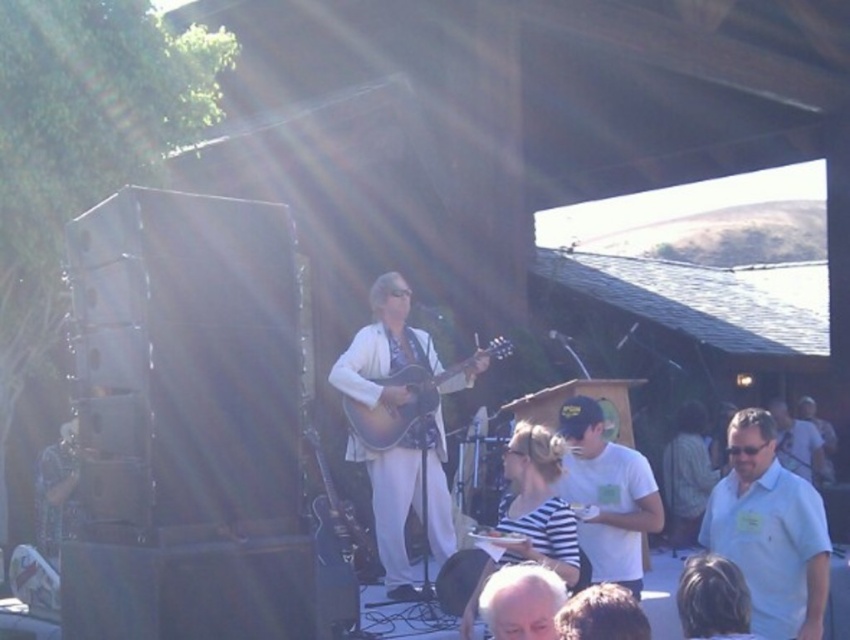
Question: Based on their relative distances, which object is nearer to the matte brown acoustic guitar at center?

Choices:
 (A) white matte hair at lower center
 (B) white shirt at center
 (C) white t-shirt at center

Answer: (C)

Question: Does white t-shirt at center have a larger size compared to glossy black guitar at center?

Choices:
 (A) yes
 (B) no

Answer: (B)

Question: Can you confirm if white shirt at lower right is thinner than matte brown guitar at center?

Choices:
 (A) yes
 (B) no

Answer: (A)

Question: In this image, where is matte brown acoustic guitar at center located relative to white shirt at center?

Choices:
 (A) right
 (B) left

Answer: (B)

Question: Based on their relative distances, which object is farther from the matte brown guitar at center?

Choices:
 (A) white shirt at center
 (B) white matte hair at lower center
 (C) white t-shirt at center
 (D) matte brown acoustic guitar at center

Answer: (A)

Question: Based on their relative distances, which object is farther from the matte brown acoustic guitar at center?

Choices:
 (A) white matte hair at lower center
 (B) white shirt at lower right
 (C) matte brown guitar at center

Answer: (A)